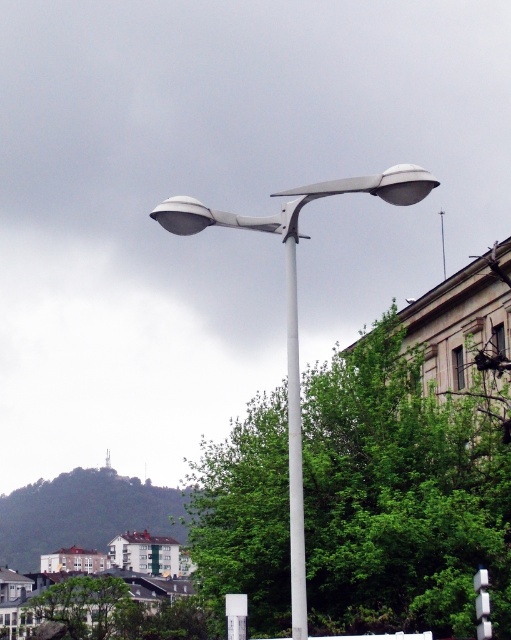
Does white glossy street light at center appear over white smooth pole at center?

Yes.

Does white glossy street light at center appear under white smooth pole at center?

Actually, white glossy street light at center is above white smooth pole at center.

In the scene shown: Who is more forward, (290,512) or (290,589)?

Point (290,512) is more forward.

The width and height of the screenshot is (511, 640). I want to click on white glossy street light at center, so click(295, 312).

Does white glossy street light at center have a smaller size compared to white plastic sign at center?

No.

I want to click on white glossy street light at center, so click(x=295, y=312).

You are a GUI agent. You are given a task and a screenshot of the screen. Output one action in this format:
    pyautogui.click(x=<x>, y=<y>)
    Task: Click on the white glossy street light at center
    The image size is (511, 640).
    Given the screenshot: What is the action you would take?
    pyautogui.click(x=295, y=312)

Between white smooth pole at center and white plastic sign at center, which one has less height?

Standing shorter between the two is white plastic sign at center.

Who is positioned more to the left, white smooth pole at center or white plastic sign at center?

Positioned to the left is white smooth pole at center.

Who is more distant from viewer, (x=298, y=499) or (x=476, y=618)?

Point (x=476, y=618)

Where is `white smooth pole at center`? Image resolution: width=511 pixels, height=640 pixels. white smooth pole at center is located at coordinates (294, 452).